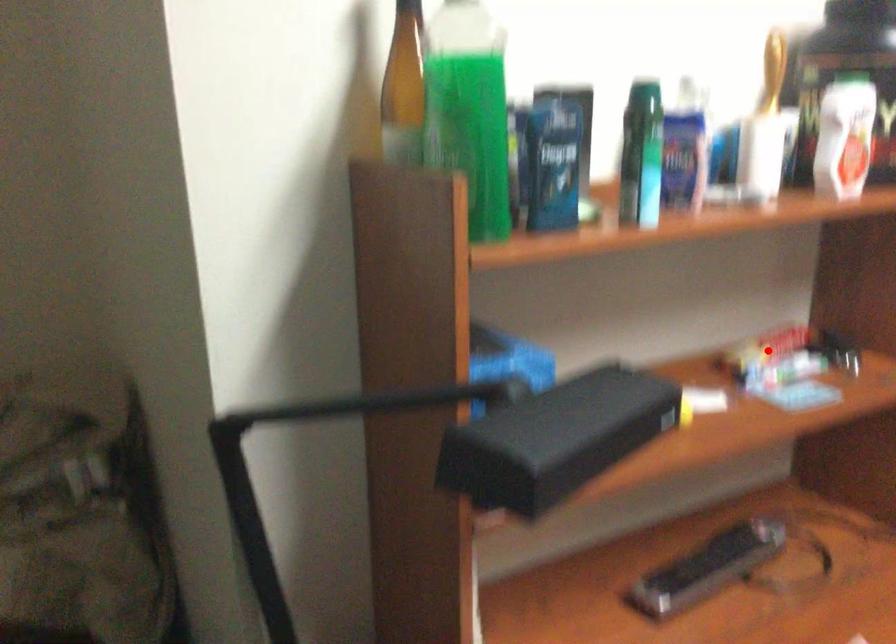
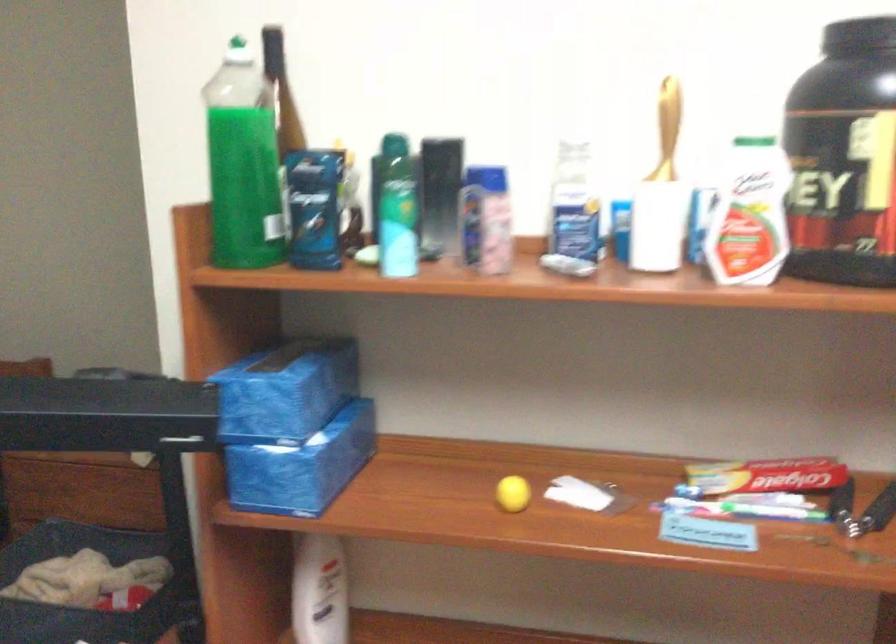
Question: I am providing you with two images of the same scene from different viewpoints. A red point is shown in image1. For the corresponding object point in image2, is it positioned nearer or farther from the camera?

Choices:
 (A) Nearer
 (B) Farther

Answer: (A)